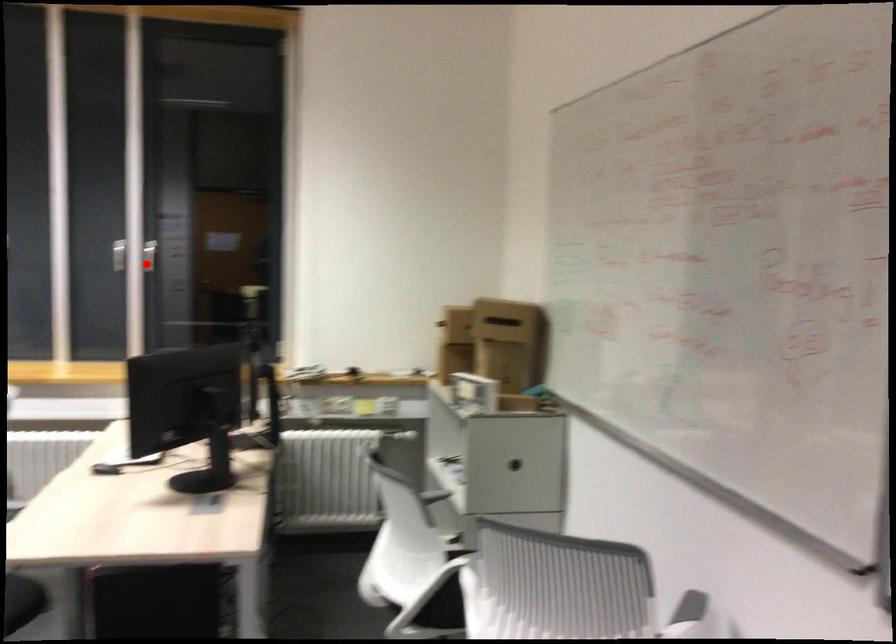
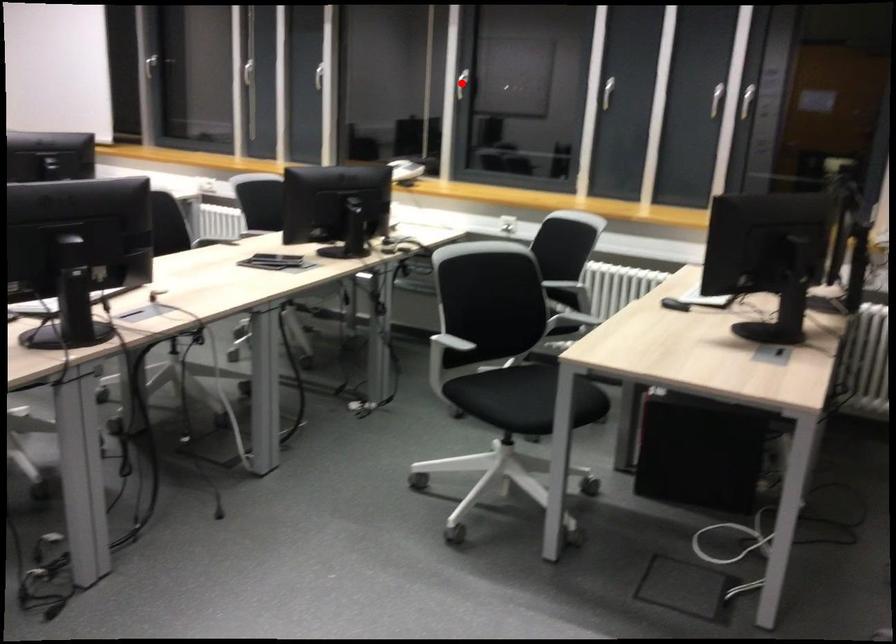
I am providing you with two images of the same scene from different viewpoints. A red point is marked on the first image and another point is marked on the second image. Are the points marked in image1 and image2 representing the same 3D position?

No